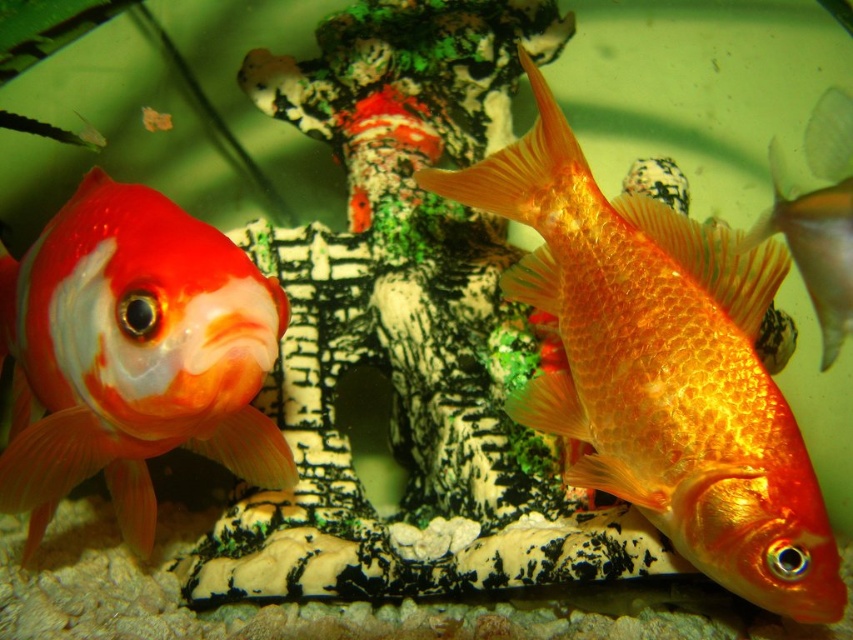
You are an underwater photographer aiming to capture the shiny orange goldfish at left. You are currently positioned at point (132,355). Can you reach the shiny orange goldfish at left from your current position?

Yes, you can reach the shiny orange goldfish at left because it is located exactly at your current position, point (132,355).